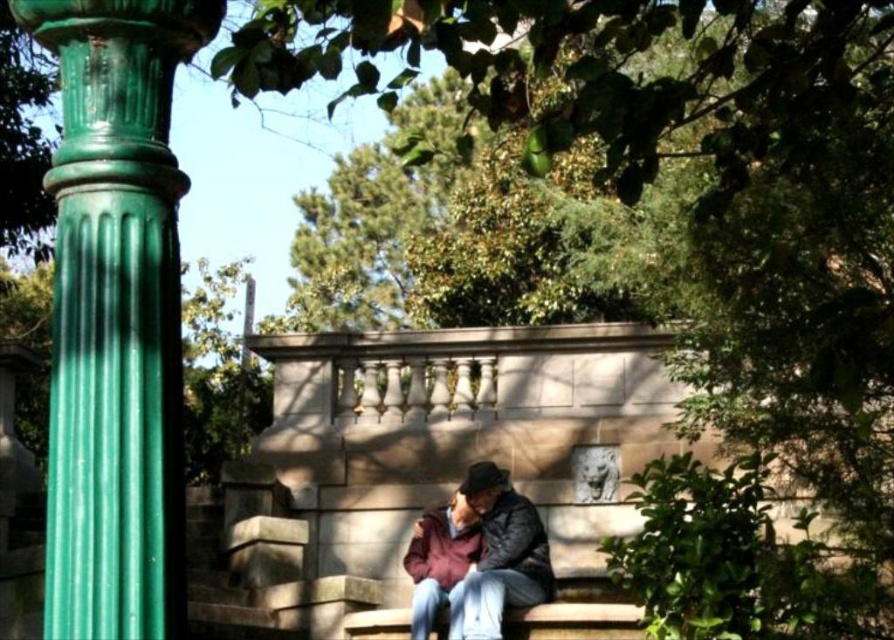
You are a visitor in the park and want to take a photo of the maroon fabric jacket at center and the green polished stone column at left. Which object should you focus on first if you want to capture both in the frame without moving your camera?

The green polished stone column at left is to the left of the maroon fabric jacket at center, so you should focus on the maroon fabric jacket at center first to ensure both are in the frame without moving the camera.